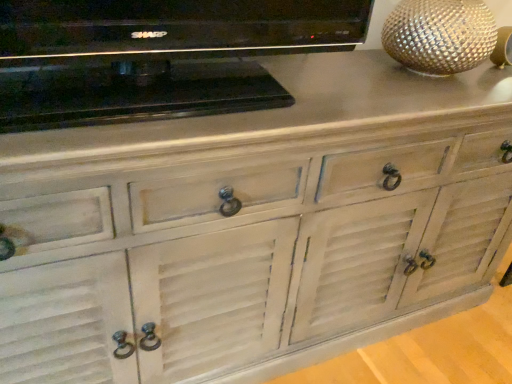
Measure the distance between point (434, 6) and camera.

The distance of point (434, 6) from camera is 1.06 meters.

At what (x,y) coordinates should I click in order to perform the action: click on gold textured sphere at upper right. Please return your answer as a coordinate pair (x, y). Looking at the image, I should click on (440, 35).

Image resolution: width=512 pixels, height=384 pixels. Describe the element at coordinates (440, 35) in the screenshot. I see `gold textured sphere at upper right` at that location.

Locate an element on the screen. The image size is (512, 384). gold textured sphere at upper right is located at coordinates (440, 35).